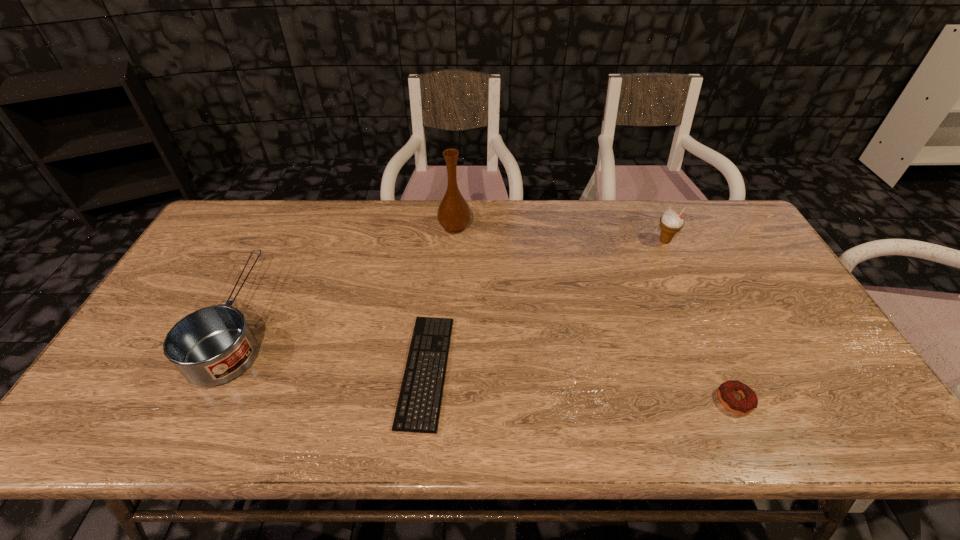
Identify the location of vase. (x=453, y=214).

This screenshot has width=960, height=540. Find the location of `icecream`. icecream is located at coordinates (670, 223).

Where is `the leftmost object`? This screenshot has height=540, width=960. the leftmost object is located at coordinates (213, 345).

Find the location of a particular element. The height and width of the screenshot is (540, 960). saucepan is located at coordinates (213, 345).

Identify the location of doughnut. Image resolution: width=960 pixels, height=540 pixels. (749, 402).

Find the location of `computer keyboard`. computer keyboard is located at coordinates [418, 408].

The image size is (960, 540). Identify the location of vacant region located on the front of the vase. (447, 335).

Where is `blank space located 0.200m on the back of the icecream`? The image size is (960, 540). blank space located 0.200m on the back of the icecream is located at coordinates (645, 199).

Locate an element on the screen. The image size is (960, 540). free space located with the handle extending from one side of the leftmost object is located at coordinates (276, 249).

At what (x,y) coordinates should I click in order to perform the action: click on vacant region located with the handle extending from one side of the leftmost object. Please return your answer as a coordinate pair (x, y). This screenshot has height=540, width=960. Looking at the image, I should click on (299, 203).